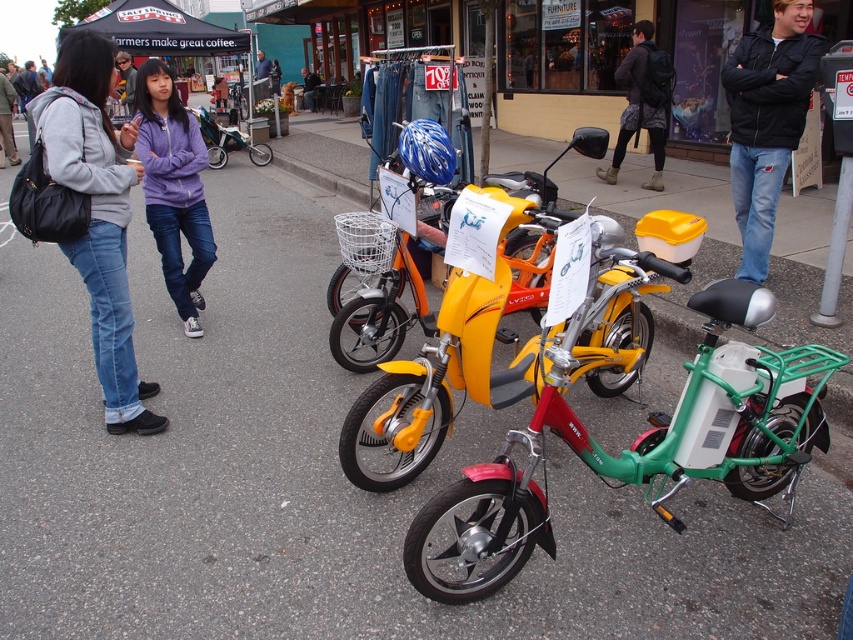
Question: Based on their relative distances, which object is farther from the matte purple hoodie at center?

Choices:
 (A) black backpack at center
 (B) black leather jacket at center

Answer: (B)

Question: Which point is farther to the camera?

Choices:
 (A) (117, 90)
 (B) (780, 100)
 (C) (347, 465)

Answer: (A)

Question: Is yellow matte/metallic scooter at center to the right of smooth blue helmet at center from the viewer's perspective?

Choices:
 (A) yes
 (B) no

Answer: (A)

Question: Which of the following is the closest to the observer?

Choices:
 (A) black backpack at center
 (B) yellow matte/metallic scooter at center
 (C) purple fleece jacket at upper left
 (D) matte purple hoodie at center

Answer: (B)

Question: Does black leather jacket at center appear under smooth blue helmet at center?

Choices:
 (A) no
 (B) yes

Answer: (B)

Question: Can you confirm if denim jeans at left is wider than matte purple hoodie at center?

Choices:
 (A) no
 (B) yes

Answer: (B)